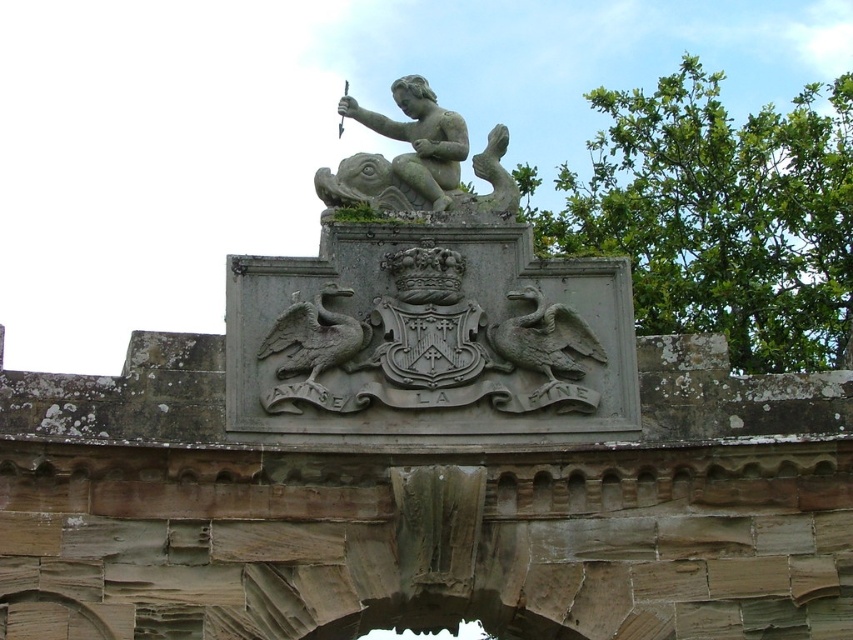
You are an architect designing a miniature model of this archway. The base of your model must accommodate both the gray stone cherub at center and the gray stone griffin at center. If the base has a width of 1 meter, will both fit side by side without overlapping?

The gray stone cherub at center is wider than the gray stone griffin at center. Since the cherub is larger in width, the combined width of both might exceed the 1 meter base. However, without exact measurements, it is uncertain. The description only states the cherub is wider, but not by how much. Thus, it is possible they may or may not fit depending on the exact dimensions.

You are an architect examining the archway and need to determine the vertical positioning of the gray stone cherub at center and the carved stone duck at center. Which one is positioned higher?

The gray stone cherub at center has a greater height compared to the carved stone duck at center, so the gray stone cherub at center is positioned higher.